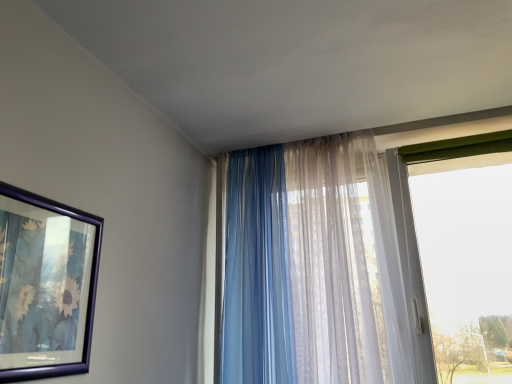
You are a GUI agent. You are given a task and a screenshot of the screen. Output one action in this format:
    pyautogui.click(x=<x>, y=<y>)
    Task: Click on the translucent sheer curtain at right, which is the second curtain in left-to-right order
    This screenshot has height=384, width=512.
    Given the screenshot: What is the action you would take?
    (x=305, y=265)

Locate an element on the screen. metallic blue picture frame at left is located at coordinates pos(46,286).

What do you see at coordinates (257, 272) in the screenshot? I see `translucent fabric curtain at center, which ranks as the second curtain in right-to-left order` at bounding box center [257, 272].

Locate an element on the screen. This screenshot has height=384, width=512. translucent sheer curtain at right, the 1th curtain viewed from the right is located at coordinates (305, 265).

Locate an element on the screen. This screenshot has height=384, width=512. curtain on the left of translucent sheer curtain at right, the 1th curtain viewed from the right is located at coordinates (257, 272).

From the image's perspective, which one is positioned higher, translucent fabric curtain at center, the first curtain when ordered from left to right, or translucent sheer curtain at right, which is the second curtain in left-to-right order?

translucent fabric curtain at center, the first curtain when ordered from left to right, is shown above in the image.

Considering the relative positions of translucent fabric curtain at center, the first curtain when ordered from left to right, and translucent sheer curtain at right, which is the second curtain in left-to-right order, in the image provided, is translucent fabric curtain at center, the first curtain when ordered from left to right, in front of translucent sheer curtain at right, which is the second curtain in left-to-right order,?

No, it is behind translucent sheer curtain at right, which is the second curtain in left-to-right order.

Is translucent sheer curtain at right, the 1th curtain viewed from the right, facing towards metallic blue picture frame at left?

Yes, translucent sheer curtain at right, the 1th curtain viewed from the right, is facing metallic blue picture frame at left.

Which object is thinner, translucent sheer curtain at right, the 1th curtain viewed from the right, or metallic blue picture frame at left?

Thinner between the two is metallic blue picture frame at left.

Based on the photo, from the image's perspective, is translucent sheer curtain at right, the 1th curtain viewed from the right, positioned above or below metallic blue picture frame at left?

Clearly, from the image's perspective, translucent sheer curtain at right, the 1th curtain viewed from the right, is below metallic blue picture frame at left.

Where is `the 1st curtain directly above the metallic blue picture frame at left (from a real-world perspective)`? the 1st curtain directly above the metallic blue picture frame at left (from a real-world perspective) is located at coordinates (305, 265).

Which is closer to the camera, (49, 361) or (233, 341)?

Point (49, 361) appears to be closer to the viewer than point (233, 341).

From the image's perspective, is metallic blue picture frame at left on translucent fabric curtain at center, which ranks as the second curtain in right-to-left order?

Yes, from the image's perspective, metallic blue picture frame at left is on top of translucent fabric curtain at center, which ranks as the second curtain in right-to-left order.

Starting from the metallic blue picture frame at left, which curtain is the 2nd one behind? Please provide its 2D coordinates.

[(257, 272)]

Is metallic blue picture frame at left aimed at translucent fabric curtain at center, which ranks as the second curtain in right-to-left order?

No, metallic blue picture frame at left does not turn towards translucent fabric curtain at center, which ranks as the second curtain in right-to-left order.

From a real-world perspective, is metallic blue picture frame at left located beneath translucent sheer curtain at right, the 1th curtain viewed from the right?

Yes, from a real-world perspective, metallic blue picture frame at left is under translucent sheer curtain at right, the 1th curtain viewed from the right.

Can you tell me how much metallic blue picture frame at left and translucent sheer curtain at right, which is the second curtain in left-to-right order, differ in facing direction?

88.6 degrees separate the facing orientations of metallic blue picture frame at left and translucent sheer curtain at right, which is the second curtain in left-to-right order.

Considering the positions of objects metallic blue picture frame at left and translucent sheer curtain at right, the 1th curtain viewed from the right, in the image provided, who is behind, metallic blue picture frame at left or translucent sheer curtain at right, the 1th curtain viewed from the right,?

translucent sheer curtain at right, the 1th curtain viewed from the right.

Considering the relative sizes of metallic blue picture frame at left and translucent sheer curtain at right, the 1th curtain viewed from the right, in the image provided, is metallic blue picture frame at left bigger than translucent sheer curtain at right, the 1th curtain viewed from the right,?

Incorrect, metallic blue picture frame at left is not larger than translucent sheer curtain at right, the 1th curtain viewed from the right.

Is translucent fabric curtain at center, which ranks as the second curtain in right-to-left order, not inside metallic blue picture frame at left?

Absolutely, translucent fabric curtain at center, which ranks as the second curtain in right-to-left order, is external to metallic blue picture frame at left.

Can you confirm if translucent fabric curtain at center, which ranks as the second curtain in right-to-left order, is bigger than metallic blue picture frame at left?

Correct, translucent fabric curtain at center, which ranks as the second curtain in right-to-left order, is larger in size than metallic blue picture frame at left.

How many degrees apart are the facing directions of translucent fabric curtain at center, which ranks as the second curtain in right-to-left order, and metallic blue picture frame at left?

translucent fabric curtain at center, which ranks as the second curtain in right-to-left order, and metallic blue picture frame at left are facing 87.4 degrees away from each other.

Image resolution: width=512 pixels, height=384 pixels. I want to click on the 1st curtain counting from the right of the metallic blue picture frame at left, so click(257, 272).

Does translucent sheer curtain at right, the 1th curtain viewed from the right, lie in front of translucent fabric curtain at center, which ranks as the second curtain in right-to-left order?

Yes, it is in front of translucent fabric curtain at center, which ranks as the second curtain in right-to-left order.

Is translucent sheer curtain at right, the 1th curtain viewed from the right, inside or outside of translucent fabric curtain at center, which ranks as the second curtain in right-to-left order?

translucent sheer curtain at right, the 1th curtain viewed from the right, cannot be found inside translucent fabric curtain at center, which ranks as the second curtain in right-to-left order.

Based on the photo, is translucent sheer curtain at right, which is the second curtain in left-to-right order, bigger than translucent fabric curtain at center, the first curtain when ordered from left to right?

Yes.

Find the location of a particular element. curtain on the left of translucent sheer curtain at right, which is the second curtain in left-to-right order is located at coordinates (257, 272).

Locate an element on the screen. picture frame below the translucent sheer curtain at right, the 1th curtain viewed from the right (from a real-world perspective) is located at coordinates (46, 286).

Based on their spatial positions, is translucent sheer curtain at right, the 1th curtain viewed from the right, or metallic blue picture frame at left further from translucent fabric curtain at center, which ranks as the second curtain in right-to-left order?

Among the two, metallic blue picture frame at left is located further to translucent fabric curtain at center, which ranks as the second curtain in right-to-left order.

Which object lies nearer to the anchor point metallic blue picture frame at left, translucent sheer curtain at right, the 1th curtain viewed from the right, or translucent fabric curtain at center, which ranks as the second curtain in right-to-left order?

translucent fabric curtain at center, which ranks as the second curtain in right-to-left order, is positioned closer to the anchor metallic blue picture frame at left.

Based on the photo, from the image, which object appears to be nearer to translucent sheer curtain at right, the 1th curtain viewed from the right, metallic blue picture frame at left or translucent fabric curtain at center, which ranks as the second curtain in right-to-left order?

The object closer to translucent sheer curtain at right, the 1th curtain viewed from the right, is translucent fabric curtain at center, which ranks as the second curtain in right-to-left order.

Considering their positions, is metallic blue picture frame at left positioned closer to translucent fabric curtain at center, which ranks as the second curtain in right-to-left order, than translucent sheer curtain at right, which is the second curtain in left-to-right order?

The object closer to translucent fabric curtain at center, which ranks as the second curtain in right-to-left order, is translucent sheer curtain at right, which is the second curtain in left-to-right order.

Estimate the real-world distances between objects in this image. Which object is closer to metallic blue picture frame at left, translucent fabric curtain at center, the first curtain when ordered from left to right, or translucent sheer curtain at right, which is the second curtain in left-to-right order?

Among the two, translucent fabric curtain at center, the first curtain when ordered from left to right, is located nearer to metallic blue picture frame at left.

From the image, which object appears to be nearer to translucent sheer curtain at right, which is the second curtain in left-to-right order, translucent fabric curtain at center, which ranks as the second curtain in right-to-left order, or metallic blue picture frame at left?

translucent fabric curtain at center, which ranks as the second curtain in right-to-left order.

Image resolution: width=512 pixels, height=384 pixels. What are the coordinates of `curtain situated between metallic blue picture frame at left and translucent sheer curtain at right, the 1th curtain viewed from the right, from left to right` in the screenshot? It's located at (257, 272).